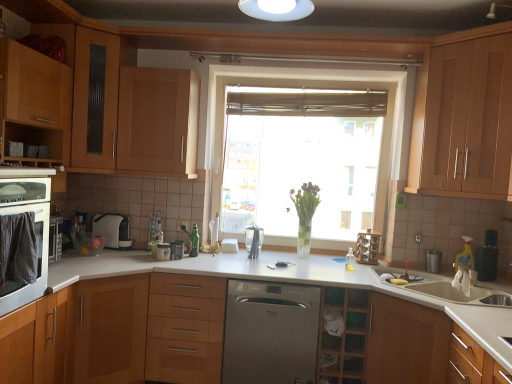
At what (x,y) coordinates should I click in order to perform the action: click on vacant space in between satin silver knife block at center, which appears as the second appliance when viewed from the right, and clear glass vase at center. Please return your answer as a coordinate pair (x, y). The width and height of the screenshot is (512, 384). Looking at the image, I should click on (277, 258).